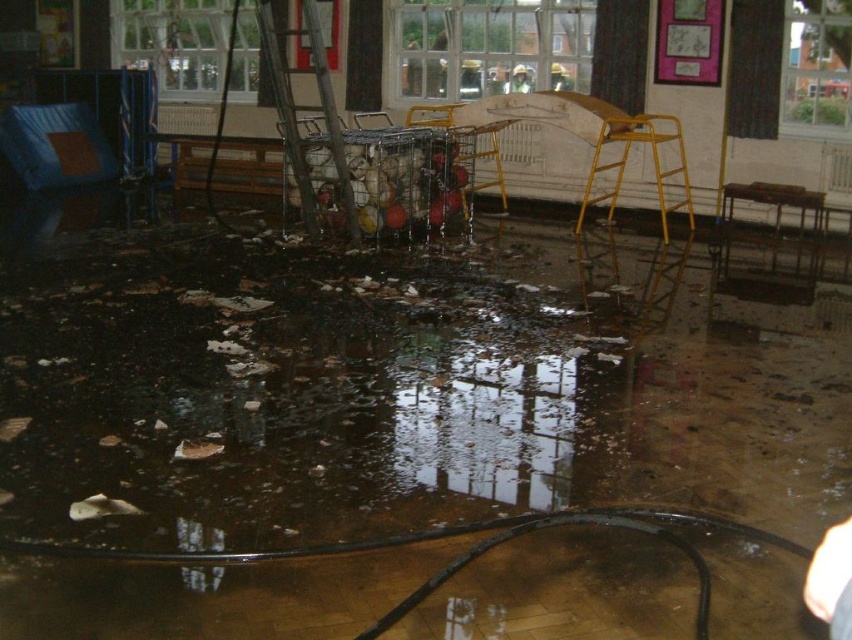
You are a rescuer entering the flooded indoor space. You need to reach the metallic yellow stool at lower right to retrieve an item. Is the blue fabric chair at left blocking your path to the stool?

The metallic yellow stool at lower right is behind the blue fabric chair at left, so the blue fabric chair at left is blocking your path to the stool.

You are a maintenance worker assessing the flooded area. You need to retrieve an item from the floor but want to stand on one of the available chairs. Which object, the blue fabric chair at left or the metallic yellow stool at lower right, is taller and thus better suited for reaching the item?

The blue fabric chair at left is much taller than the metallic yellow stool at lower right, making it better suited for reaching the item.

You are a rescue worker in the flooded indoor space. You need to locate the blue fabric chair at left. Where is it located in the scene?

The blue fabric chair at left is located at point (55, 147) in the scene.